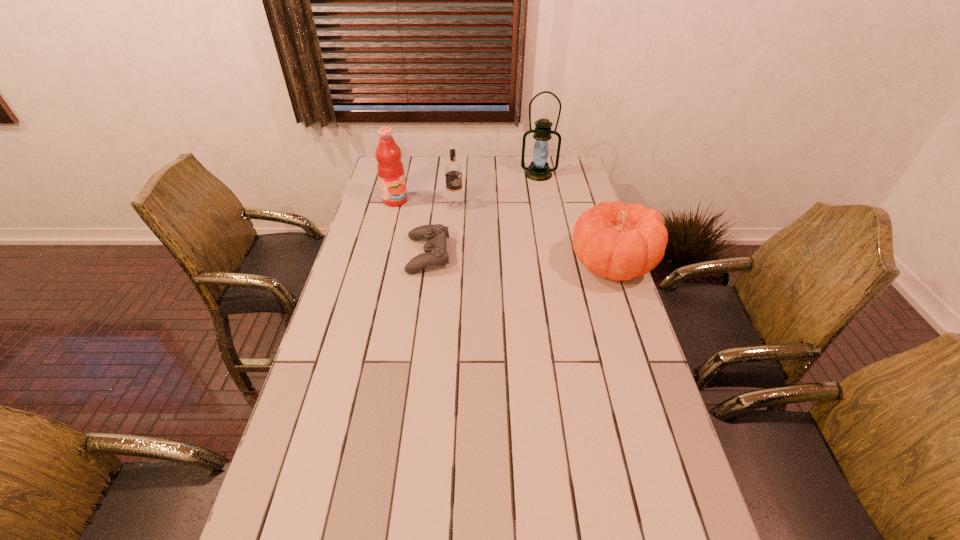
This screenshot has width=960, height=540. I want to click on free point between the tallest object and the shortest object, so click(484, 214).

The height and width of the screenshot is (540, 960). What are the coordinates of `vacant region between the leftmost object and the control` in the screenshot? It's located at (412, 228).

Identify the location of vacant area that lies between the third tallest object and the fruit juice. The image size is (960, 540). (425, 203).

Locate an element on the screen. This screenshot has height=540, width=960. unoccupied area between the leftmost object and the vodka is located at coordinates (425, 203).

Locate an element on the screen. vacant area between the tallest object and the control is located at coordinates (484, 214).

Find the location of a particular element. Image resolution: width=960 pixels, height=540 pixels. vacant space that is in between the lantern and the fruit juice is located at coordinates (467, 187).

Select which object is the third closest to the vodka. Please provide its 2D coordinates. Your answer should be formatted as a tuple, i.e. [(x, y)], where the tuple contains the x and y coordinates of a point satisfying the conditions above.

[(538, 170)]

Identify the location of object that ranks as the closest to the farthest object. The height and width of the screenshot is (540, 960). (453, 171).

The image size is (960, 540). I want to click on vacant space that satisfies the following two spatial constraints: 1. on the front side of the pumpkin; 2. on the left side of the fourth shortest object, so click(x=379, y=264).

Where is `free spot that satisfies the following two spatial constraints: 1. on the front side of the control; 2. on the right side of the second shortest object`? The image size is (960, 540). free spot that satisfies the following two spatial constraints: 1. on the front side of the control; 2. on the right side of the second shortest object is located at coordinates (427, 264).